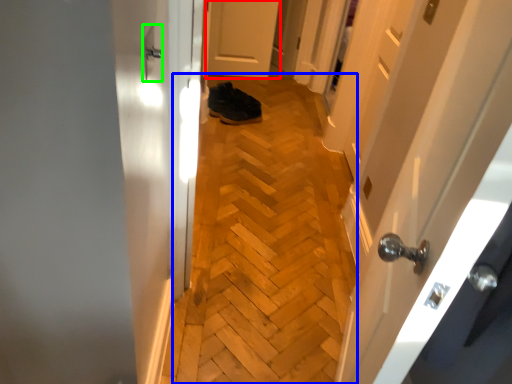
Question: Estimate the real-world distances between objects in this image. Which object is closer to door (highlighted by a red box), corridor (highlighted by a blue box) or door handle (highlighted by a green box)?

Choices:
 (A) corridor
 (B) door handle

Answer: (A)